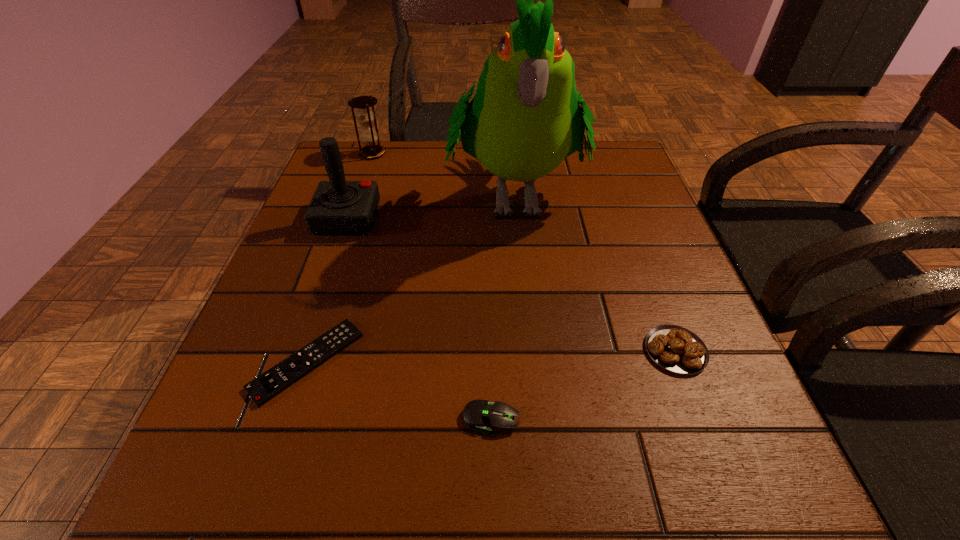
Identify the location of object that is at the far left corner. (369, 137).

Identify the location of object at the far right corner. (524, 119).

In the image, there is a desktop. What are the coordinates of `free space at the far edge` in the screenshot? It's located at (x=455, y=185).

This screenshot has height=540, width=960. Identify the location of vacant space at the left edge of the desktop. (293, 435).

This screenshot has height=540, width=960. I want to click on free spot at the right edge of the desktop, so click(x=599, y=267).

You are a GUI agent. You are given a task and a screenshot of the screen. Output one action in this format:
    pyautogui.click(x=<x>, y=<y>)
    Task: Click on the vacant space at the far left corner
    This screenshot has height=540, width=960.
    Given the screenshot: What is the action you would take?
    pyautogui.click(x=352, y=179)

Find the location of a particular element. The width and height of the screenshot is (960, 540). free space at the near left corner of the desktop is located at coordinates (268, 504).

Identify the location of free spot between the joystick and the remote control. Image resolution: width=960 pixels, height=540 pixels. (327, 290).

Where is `free space between the joystick and the second shortest object`? The height and width of the screenshot is (540, 960). free space between the joystick and the second shortest object is located at coordinates (420, 319).

Locate an element on the screen. The image size is (960, 540). vacant area that lies between the tallest object and the computer mouse is located at coordinates (503, 306).